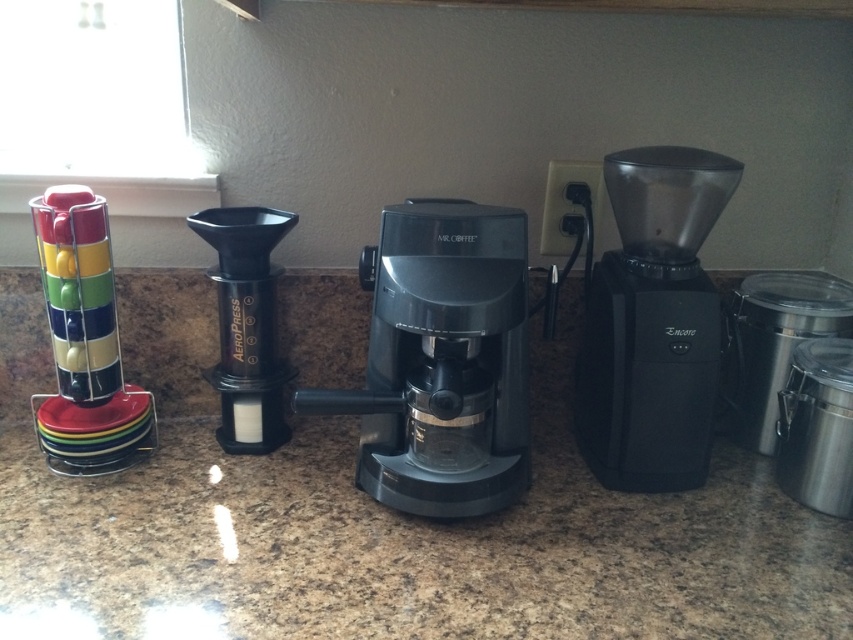
From the picture: Which is below, black plastic coffee machine at center or multicolored plastic cups at left?

black plastic coffee machine at center

In order to click on black plastic coffee machine at center in this screenshot , I will do `click(440, 360)`.

Does granite countertop at center appear under multicolored plastic cups at left?

Correct, granite countertop at center is located below multicolored plastic cups at left.

Can you confirm if granite countertop at center is positioned to the left of multicolored plastic cups at left?

No, granite countertop at center is not to the left of multicolored plastic cups at left.

I want to click on granite countertop at center, so click(x=384, y=516).

Is black plastic coffee grinder at right below black matte aeropress at center?

No.

Is point (695, 154) positioned before point (258, 442)?

Yes, it is in front of point (258, 442).

This screenshot has height=640, width=853. What do you see at coordinates (653, 323) in the screenshot?
I see `black plastic coffee grinder at right` at bounding box center [653, 323].

The height and width of the screenshot is (640, 853). Identify the location of black plastic coffee grinder at right. [653, 323].